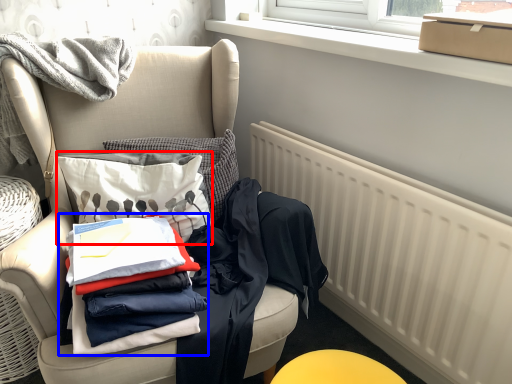
Question: Which of the following is the closest to the observer, throw pillow (highlighted by a red box) or clothing (highlighted by a blue box)?

Choices:
 (A) throw pillow
 (B) clothing

Answer: (B)